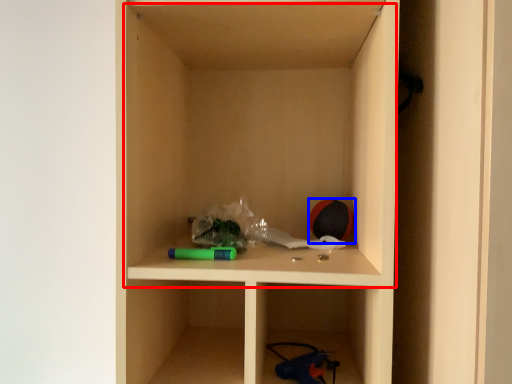
Question: Among these objects, which one is nearest to the camera, cabinet (highlighted by a red box) or toy (highlighted by a blue box)?

Choices:
 (A) cabinet
 (B) toy

Answer: (A)